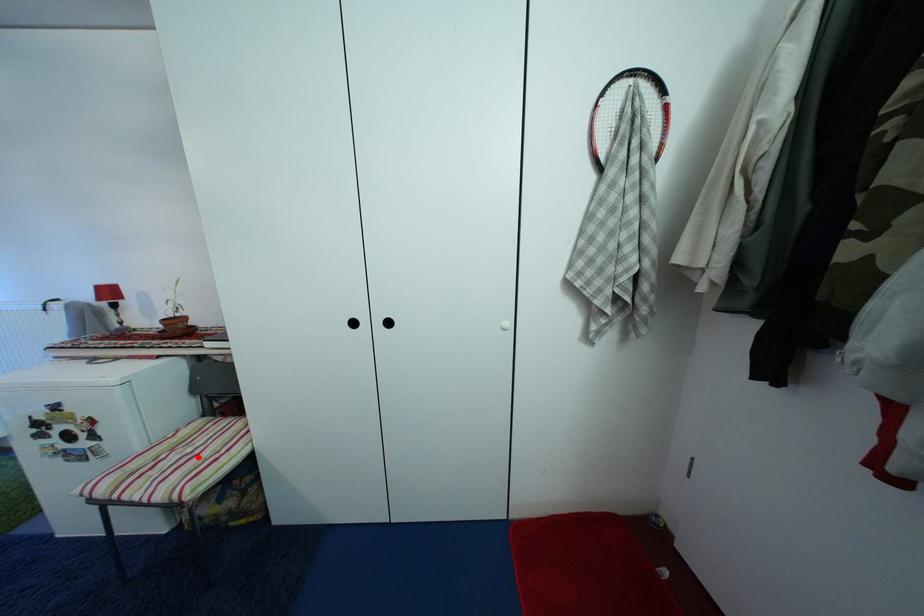
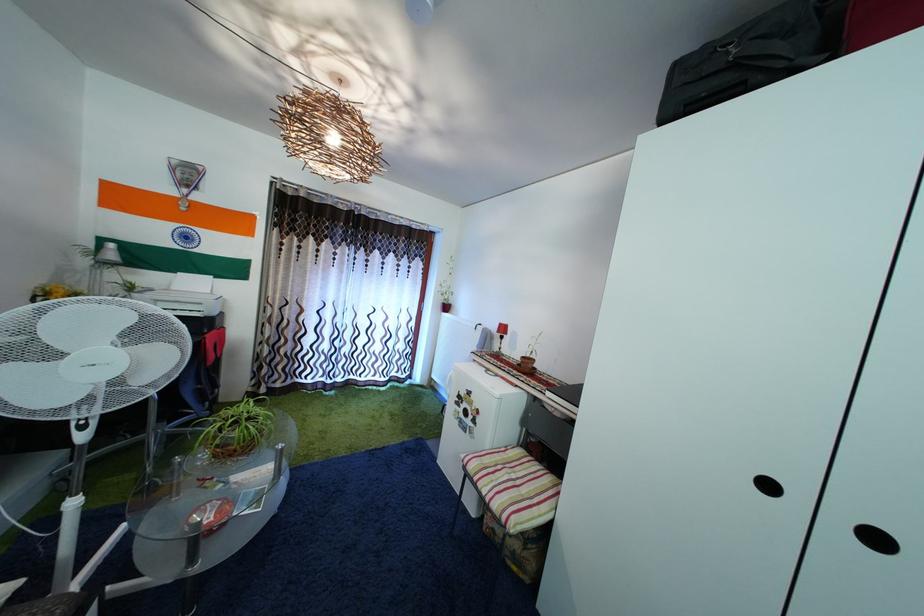
Find the pixel in the second image that matches the highlighted location in the first image.

(521, 484)